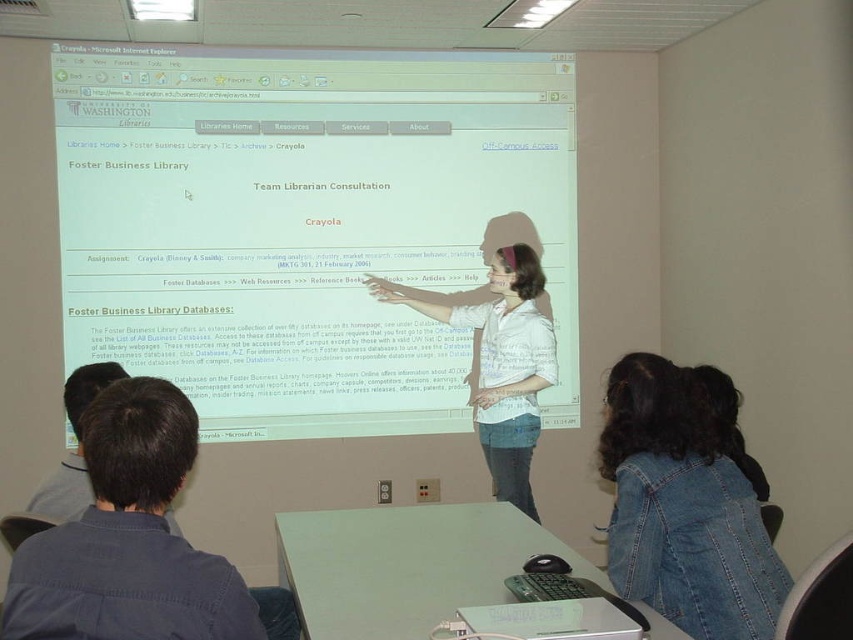
Question: Can you confirm if white glossy projection screen at upper center is wider than denim jacket at lower right?

Choices:
 (A) no
 (B) yes

Answer: (B)

Question: Which point is closer to the camera?

Choices:
 (A) white striped shirt at center
 (B) denim jacket at lower right

Answer: (B)

Question: Can you confirm if white glossy projection screen at upper center is positioned above white striped shirt at center?

Choices:
 (A) no
 (B) yes

Answer: (B)

Question: Which object appears farthest from the camera in this image?

Choices:
 (A) white glossy projection screen at upper center
 (B) white striped shirt at center

Answer: (A)

Question: Does white glossy projection screen at upper center come in front of white striped shirt at center?

Choices:
 (A) yes
 (B) no

Answer: (B)

Question: Which object appears closest to the camera in this image?

Choices:
 (A) white striped shirt at center
 (B) denim jacket at lower right

Answer: (B)